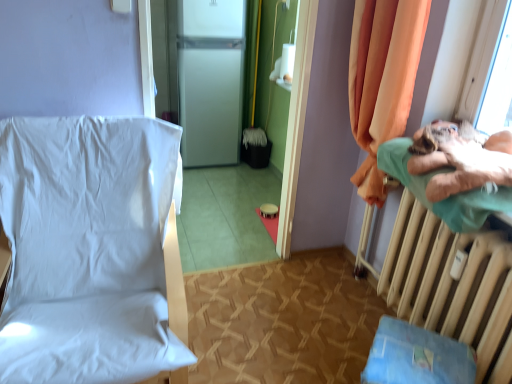
Question: Considering the positions of orange fabric curtain at right and blue fabric changing table at lower right in the image, is orange fabric curtain at right wider or thinner than blue fabric changing table at lower right?

Choices:
 (A) thin
 (B) wide

Answer: (A)

Question: Is point (367, 117) closer or farther from the camera than point (436, 380)?

Choices:
 (A) closer
 (B) farther

Answer: (B)

Question: Estimate the real-world distances between objects in this image. Which object is farther from the blue fabric changing table at lower right?

Choices:
 (A) orange fabric curtain at right
 (B) white matte refrigerator at center
 (C) white fabric chair at left
 (D) green fabric pillow at right
 (E) beige metallic radiator at right

Answer: (B)

Question: Estimate the real-world distances between objects in this image. Which object is closer to the beige metallic radiator at right?

Choices:
 (A) orange fabric curtain at right
 (B) green fabric pillow at right
 (C) white matte refrigerator at center
 (D) blue fabric changing table at lower right
 (E) white fabric chair at left

Answer: (D)